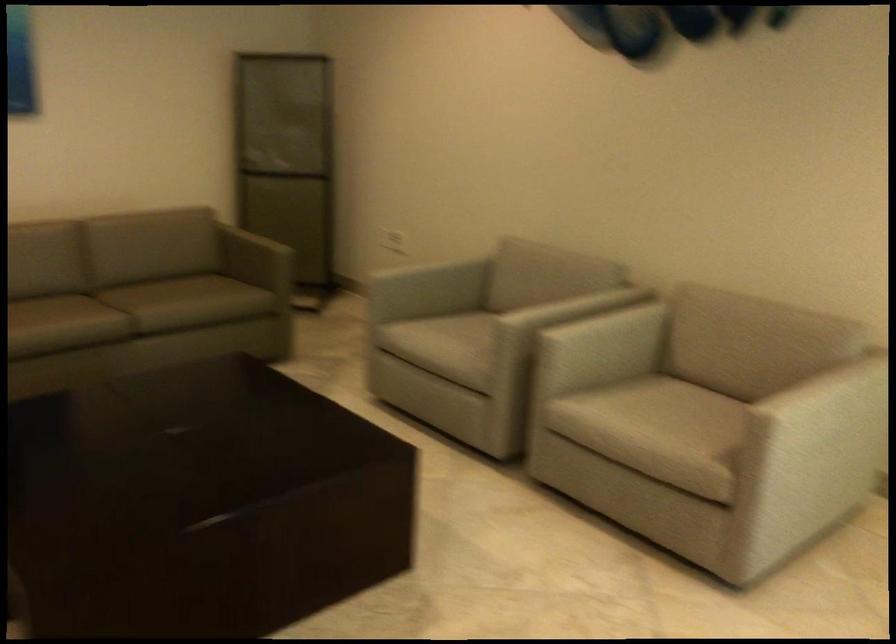
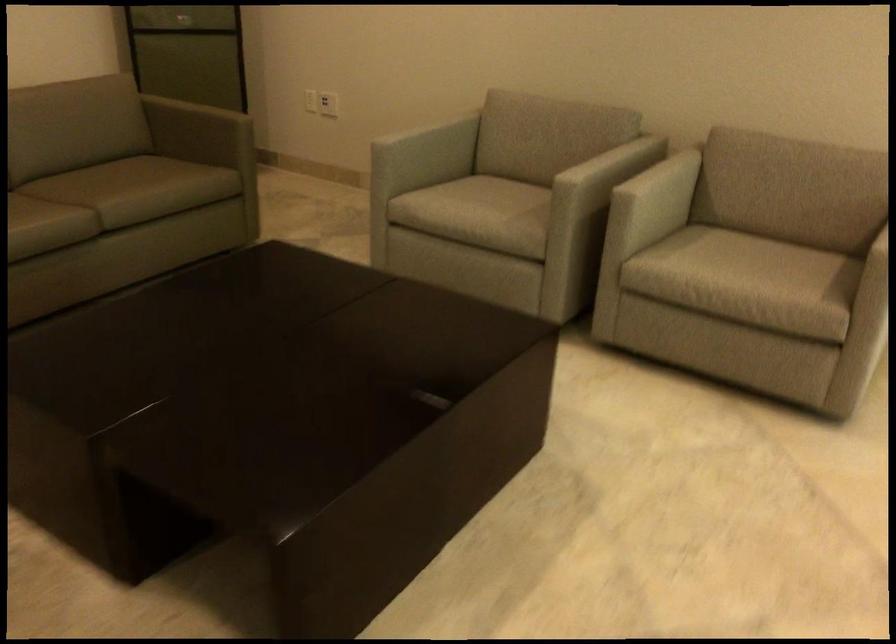
In the second image, find the point that corresponds to [426,265] in the first image.

(423, 127)